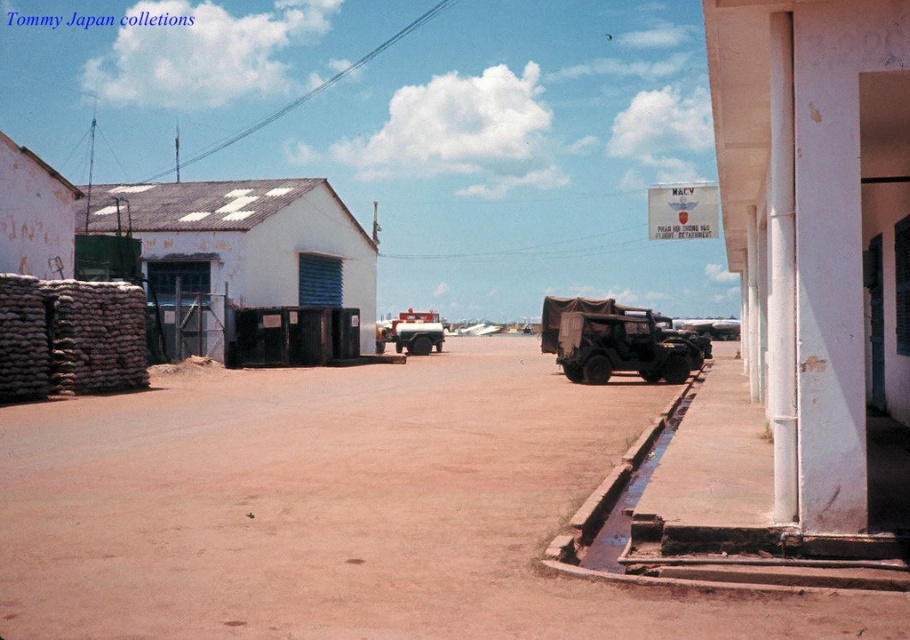
You are a delivery driver arriving at a military base. You need to park your vehicle at the center of the paved area. However, there is an obstacle at point (613, 340). What is the obstacle blocking your parking spot?

The obstacle at point (613, 340) is a camouflage fabric jeep at center, which is blocking the parking spot.

You are a delivery driver approaching the brown dirt track at center and the matte red truck at center. Which object will you encounter first as you move forward?

The brown dirt track at center is closer to the viewer than the matte red truck at center, so you will encounter the brown dirt track at center first.